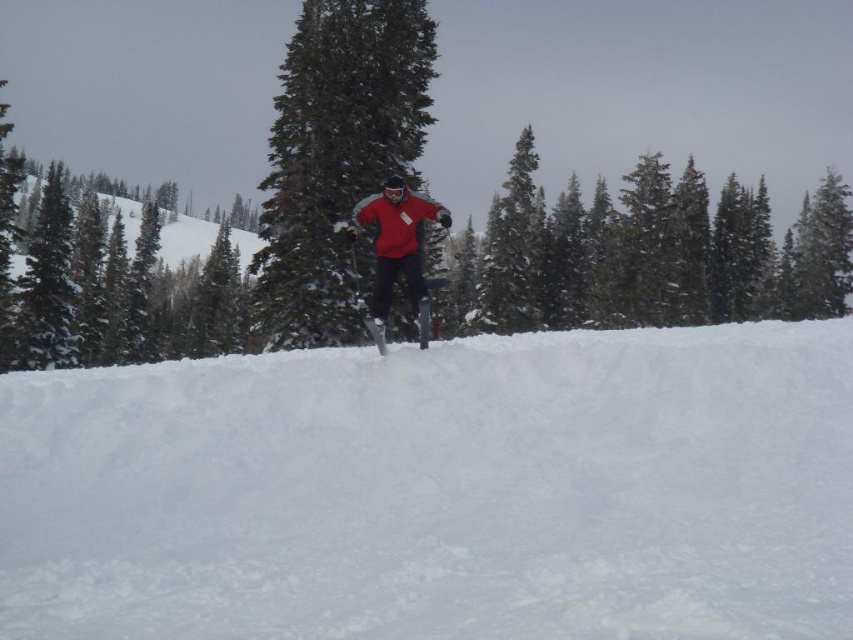
Question: Which point appears farthest from the camera in this image?

Choices:
 (A) (418, 342)
 (B) (378, 205)

Answer: (A)

Question: Which of the following is the closest to the observer?

Choices:
 (A) (373, 326)
 (B) (157, 429)
 (C) (368, 316)
 (D) (410, 161)

Answer: (B)

Question: Can you confirm if green textured pine tree at center is positioned below matte black ski at center?

Choices:
 (A) no
 (B) yes

Answer: (A)

Question: Which object appears farthest from the camera in this image?

Choices:
 (A) matte red snowboarder at center
 (B) white fluffy snow at center
 (C) green textured pine tree at center

Answer: (C)

Question: Considering the relative positions of green textured pine tree at center and matte black ski at center in the image provided, where is green textured pine tree at center located with respect to matte black ski at center?

Choices:
 (A) above
 (B) below

Answer: (A)

Question: Can you confirm if white fluffy snow at center is positioned to the left of matte red snowboarder at center?

Choices:
 (A) no
 (B) yes

Answer: (A)